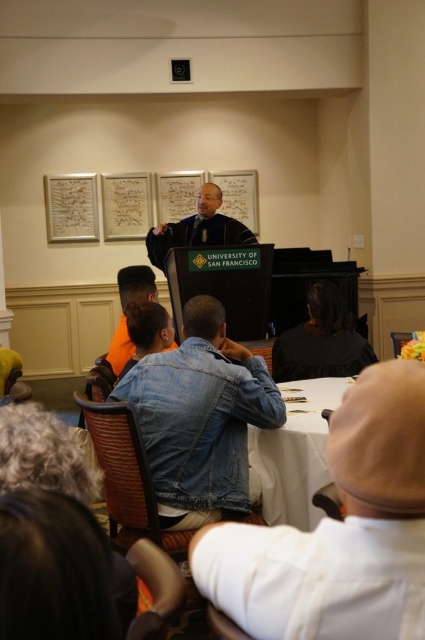
You are standing in the room and see a point at coordinates (339, 531). Based on the scene description, what object is located at that point?

The point at coordinates (339, 531) is located on the denim jacket at lower right.